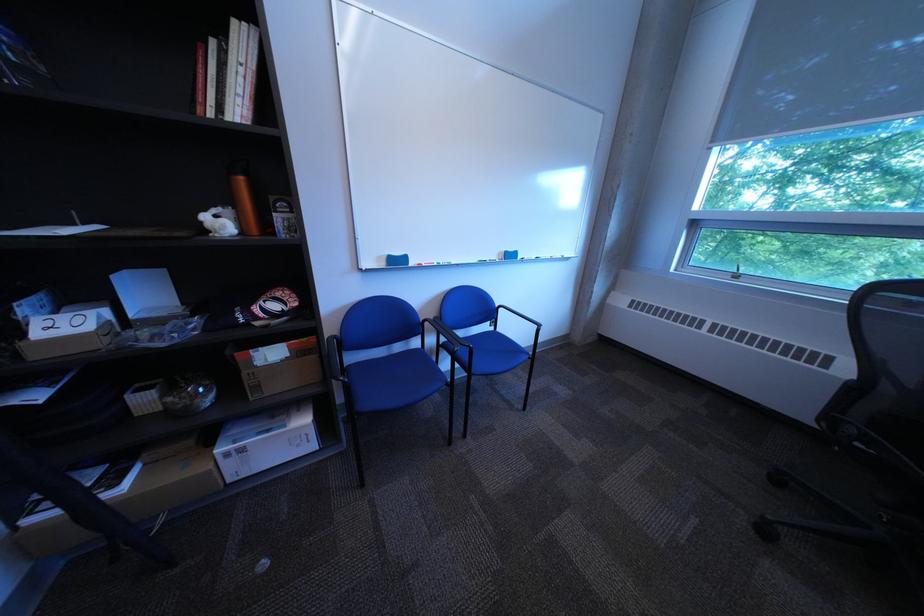
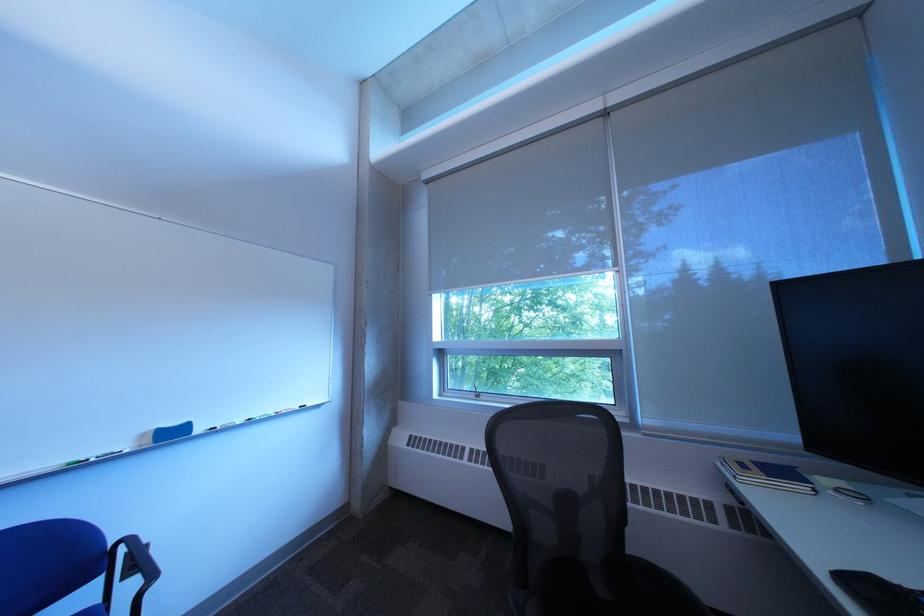
Locate, in the second image, the point that corresponds to point (515, 254) in the first image.

(159, 437)